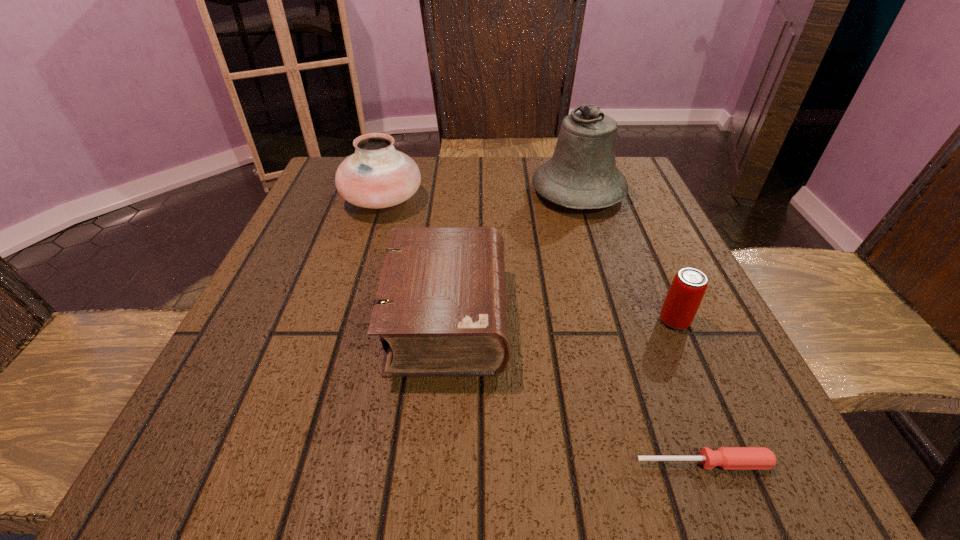
You are a GUI agent. You are given a task and a screenshot of the screen. Output one action in this format:
    pyautogui.click(x=<x>, y=<y>)
    Task: Click on the vacant space located 0.380m on the left of the screwdriver
    This screenshot has width=960, height=540.
    Given the screenshot: What is the action you would take?
    pyautogui.click(x=336, y=463)

The height and width of the screenshot is (540, 960). In order to click on bell located in the far edge section of the desktop in this screenshot , I will do [x=582, y=174].

Image resolution: width=960 pixels, height=540 pixels. I want to click on pottery located in the far edge section of the desktop, so click(x=377, y=175).

I want to click on object located at the near edge, so click(x=728, y=458).

Image resolution: width=960 pixels, height=540 pixels. In order to click on object situated at the left edge in this screenshot , I will do `click(377, 175)`.

Where is `bell at the right edge`? bell at the right edge is located at coordinates (582, 174).

In order to click on beer can located at the right edge in this screenshot , I will do `click(689, 285)`.

Locate an element on the screen. This screenshot has height=540, width=960. screwdriver present at the right edge is located at coordinates (728, 458).

You are a GUI agent. You are given a task and a screenshot of the screen. Output one action in this format:
    pyautogui.click(x=<x>, y=<y>)
    Task: Click on the object that is positioned at the far left corner
    This screenshot has height=540, width=960.
    Given the screenshot: What is the action you would take?
    pyautogui.click(x=377, y=175)

The height and width of the screenshot is (540, 960). I want to click on object that is at the far right corner, so click(582, 174).